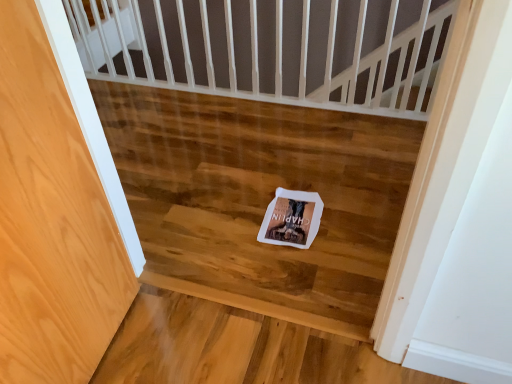
Locate an element on the screen. The height and width of the screenshot is (384, 512). vacant point to the right of white paper postcard at center is located at coordinates (350, 213).